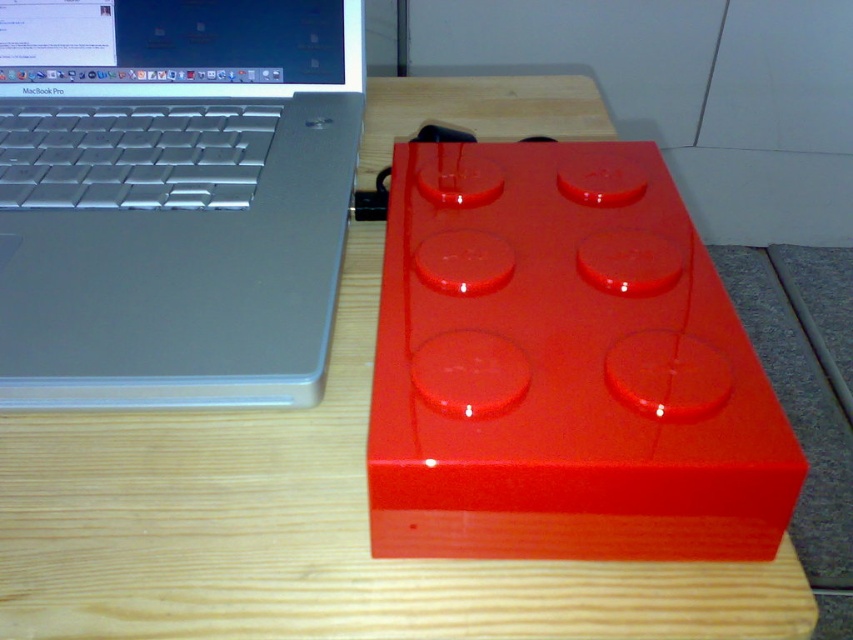
You are holding a 12 inch ruler and want to measure the distance from your eyes to the point at coordinates point (651, 538). Based on the image, can your ruler reach that distance?

The point (651, 538) is 11.66 inches from the viewer, so yes, the 12 inch ruler can reach that distance since it is slightly longer than the required measurement.